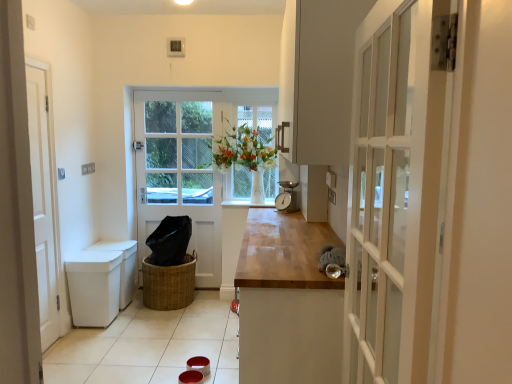
The width and height of the screenshot is (512, 384). I want to click on white wooden door at center, marked as the first door in a right-to-left arrangement, so click(191, 161).

The image size is (512, 384). Describe the element at coordinates (169, 284) in the screenshot. I see `woven brown basket at center` at that location.

What do you see at coordinates (252, 158) in the screenshot? The height and width of the screenshot is (384, 512). I see `clear glass window at center` at bounding box center [252, 158].

What do you see at coordinates (287, 197) in the screenshot? The image size is (512, 384). I see `metallic silver scale at center` at bounding box center [287, 197].

Looking at this image, what is the approximate height of white plastic bin at lower left?

white plastic bin at lower left is 21.68 inches in height.

I want to click on white wooden door at center, the 1th door from the back, so click(191, 161).

Which object is positioned more to the left, white plastic bin at lower left or woven brown basket at center?

From the viewer's perspective, white plastic bin at lower left appears more on the left side.

Is white plastic bin at lower left in front of or behind woven brown basket at center in the image?

Visually, white plastic bin at lower left is located in front of woven brown basket at center.

Considering the positions of points (132, 254) and (162, 270), is point (132, 254) closer to camera compared to point (162, 270)?

That is False.

Does point (232, 204) come behind point (37, 221)?

Yes, it is.

Is white glossy window sill at center oriented away from white wooden door at left, which ranks as the first door in left-to-right order?

white glossy window sill at center is not turned away from white wooden door at left, which ranks as the first door in left-to-right order.

How far apart are white glossy window sill at center and white wooden door at left, the 2th door positioned from the right?

white glossy window sill at center is 5.32 feet from white wooden door at left, the 2th door positioned from the right.

Considering the relative sizes of white glossy window sill at center and white wooden door at left, the first door from the front, in the image provided, is white glossy window sill at center thinner than white wooden door at left, the first door from the front,?

In fact, white glossy window sill at center might be wider than white wooden door at left, the first door from the front.

What's the angular difference between clear glass window at center and white wooden door at center, placed as the second door when sorted from front to back,'s facing directions?

The angle between the facing direction of clear glass window at center and the facing direction of white wooden door at center, placed as the second door when sorted from front to back, is 0.000269 degrees.

Does point (256, 126) come closer to viewer compared to point (206, 191)?

Yes.

Is clear glass window at center surrounding white wooden door at center, marked as the first door in a right-to-left arrangement?

No, white wooden door at center, marked as the first door in a right-to-left arrangement, is located outside of clear glass window at center.

Does clear glass window at center have a greater width compared to white wooden door at center, the 1th door from the back?

No.

From the image's perspective, which object appears higher, white glossy window sill at center or white wooden door at center, marked as the first door in a right-to-left arrangement?

white wooden door at center, marked as the first door in a right-to-left arrangement, is shown above in the image.

Is white glossy window sill at center not inside white wooden door at center, the 1th door from the back?

white glossy window sill at center lies outside white wooden door at center, the 1th door from the back,'s area.

Considering the positions of point (261, 205) and point (209, 170), is point (261, 205) closer or farther from the camera than point (209, 170)?

Point (261, 205) appears to be closer to the viewer than point (209, 170).

Based on their positions, is white glossy window sill at center located to the left or right of white wooden door at center, the 2th door from the left?

white glossy window sill at center is to the right of white wooden door at center, the 2th door from the left.

From the image's perspective, between white wooden door at center, marked as the first door in a right-to-left arrangement, and metallic silver scale at center, which one is located above?

white wooden door at center, marked as the first door in a right-to-left arrangement, from the image's perspective.

Considering the sizes of objects white wooden door at center, marked as the first door in a right-to-left arrangement, and metallic silver scale at center in the image provided, who is smaller, white wooden door at center, marked as the first door in a right-to-left arrangement, or metallic silver scale at center?

With smaller size is metallic silver scale at center.

Is the position of white wooden door at center, the 2th door from the left, more distant than that of metallic silver scale at center?

Yes, white wooden door at center, the 2th door from the left, is further from the viewer.

Are white wooden door at center, the 2th door from the left, and metallic silver scale at center far apart?

That's not correct — white wooden door at center, the 2th door from the left, is a little close to metallic silver scale at center.

Is the depth of clear glass window at center greater than that of white wooden door at left, which ranks as the first door in left-to-right order?

Yes, it is behind white wooden door at left, which ranks as the first door in left-to-right order.

Does clear glass window at center turn towards white wooden door at left, the first door from the front?

No.

From a real-world perspective, between clear glass window at center and white wooden door at left, which ranks as the first door in left-to-right order, who is vertically lower?

white wooden door at left, which ranks as the first door in left-to-right order.

From a real-world perspective, relative to white glossy window sill at center, is woven brown basket at center vertically above or below?

Clearly, from a real-world perspective, woven brown basket at center is below white glossy window sill at center.

Is woven brown basket at center facing away from white glossy window sill at center?

No, woven brown basket at center is not facing the opposite direction of white glossy window sill at center.

Between woven brown basket at center and white glossy window sill at center, which one is positioned behind?

white glossy window sill at center.

Is white glossy window sill at center a part of woven brown basket at center?

Actually, white glossy window sill at center is outside woven brown basket at center.

I want to click on cabinetry in front of the woven brown basket at center, so click(122, 266).

Where is `window sill lying behind the white wooden door at left, which ranks as the first door in left-to-right order`? The image size is (512, 384). window sill lying behind the white wooden door at left, which ranks as the first door in left-to-right order is located at coordinates (247, 204).

Looking at this image, based on their spatial positions, is white wooden door at center, placed as the second door when sorted from front to back, or metallic silver scale at center further from white wooden door at left, the second door viewed from the back?

The object further to white wooden door at left, the second door viewed from the back, is metallic silver scale at center.

Considering their positions, is clear glass window at center positioned further to white wooden door at center, the 2th door from the left, than woven brown basket at center?

woven brown basket at center is further to white wooden door at center, the 2th door from the left.

From the image, which object appears to be nearer to woven brown basket at center, clear glass window at center or white wooden door at center, placed as the second door when sorted from front to back?

white wooden door at center, placed as the second door when sorted from front to back, lies closer to woven brown basket at center than the other object.

Consider the image. From the image, which object appears to be nearer to woven brown basket at center, white plastic bin at lower left or white glossy window sill at center?

white plastic bin at lower left is closer to woven brown basket at center.

Which object lies further to the anchor point white glossy window sill at center, white plastic bin at lower left or white wooden door at left, the 2th door positioned from the right?

Among the two, white wooden door at left, the 2th door positioned from the right, is located further to white glossy window sill at center.

From the image, which object appears to be nearer to white glossy window sill at center, woven brown basket at center or clear glass window at center?

clear glass window at center.

When comparing their distances from metallic silver scale at center, does clear glass window at center or white wooden door at left, which ranks as the first door in left-to-right order, seem further?

white wooden door at left, which ranks as the first door in left-to-right order, is positioned further to the anchor metallic silver scale at center.

Considering their positions, is metallic silver scale at center positioned closer to white glossy window sill at center than white wooden door at center, the 1th door from the back?

metallic silver scale at center lies closer to white glossy window sill at center than the other object.

You are a GUI agent. You are given a task and a screenshot of the screen. Output one action in this format:
    pyautogui.click(x=<x>, y=<y>)
    Task: Click on the door between white plastic bin at lower left and metallic silver scale at center from left to right
    This screenshot has height=384, width=512.
    Given the screenshot: What is the action you would take?
    pyautogui.click(x=191, y=161)

Locate an element on the screen. cabinetry between white wooden door at center, the 2th door from the left, and woven brown basket at center vertically is located at coordinates (122, 266).

Find the location of `window sill situated between white plastic bin at lower left and metallic silver scale at center from left to right`. window sill situated between white plastic bin at lower left and metallic silver scale at center from left to right is located at coordinates (247, 204).

The image size is (512, 384). In order to click on window sill between clear glass window at center and woven brown basket at center in the up-down direction in this screenshot , I will do `click(247, 204)`.